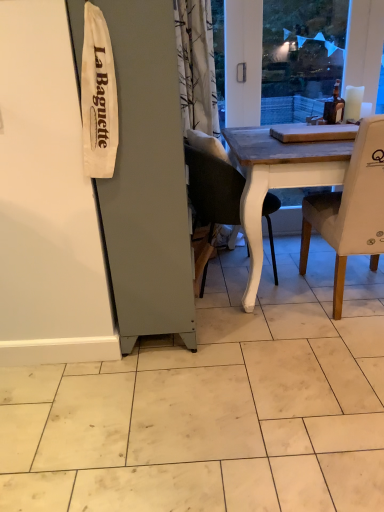
Locate an element on the screen. This screenshot has width=384, height=512. vacant space to the right of matte black chair at center, which is the second chair from right to left is located at coordinates (296, 269).